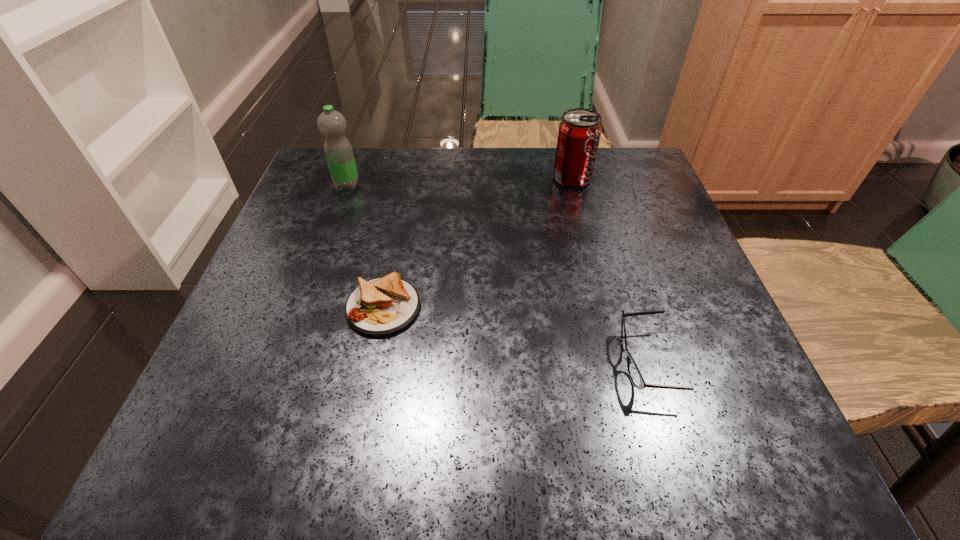
The height and width of the screenshot is (540, 960). I want to click on free area in between the pop soda and the tallest object, so click(460, 181).

Find the location of a particular element. vacant area between the third shortest object and the spectacles is located at coordinates (609, 271).

At what (x,y) coordinates should I click in order to perform the action: click on vacant point located between the third shortest object and the spectacles. Please return your answer as a coordinate pair (x, y). Image resolution: width=960 pixels, height=540 pixels. Looking at the image, I should click on (609, 271).

The width and height of the screenshot is (960, 540). Identify the location of empty space between the third object from right to left and the third shortest object. (477, 243).

Where is `free space between the tallest object and the pop soda`? The image size is (960, 540). free space between the tallest object and the pop soda is located at coordinates (460, 181).

This screenshot has width=960, height=540. Find the location of `vacant point located between the second tallest object and the water bottle`. vacant point located between the second tallest object and the water bottle is located at coordinates (460, 181).

At what (x,y) coordinates should I click in order to perform the action: click on object that can be found as the third closest to the spectacles. Please return your answer as a coordinate pair (x, y). This screenshot has height=540, width=960. Looking at the image, I should click on (332, 124).

Identify which object is the third closest to the spectacles. Please provide its 2D coordinates. Your answer should be formatted as a tuple, i.e. [(x, y)], where the tuple contains the x and y coordinates of a point satisfying the conditions above.

[(332, 124)]

The width and height of the screenshot is (960, 540). Identify the location of vacant area that satisfies the following two spatial constraints: 1. on the back side of the sandwich; 2. on the right side of the pop soda. (409, 178).

In order to click on free space that satisfies the following two spatial constraints: 1. on the back side of the pop soda; 2. on the right side of the sandwich in this screenshot , I will do [409, 178].